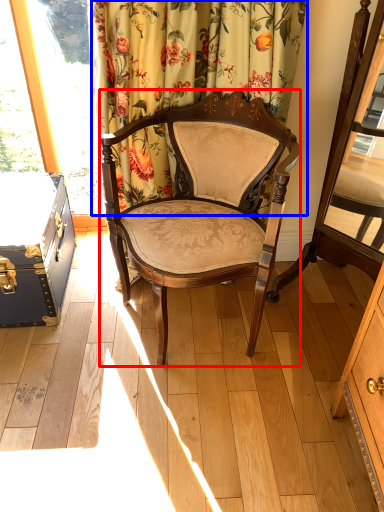
Question: Which of the following is the closest to the observer, chair (highlighted by a red box) or curtain (highlighted by a blue box)?

Choices:
 (A) chair
 (B) curtain

Answer: (A)